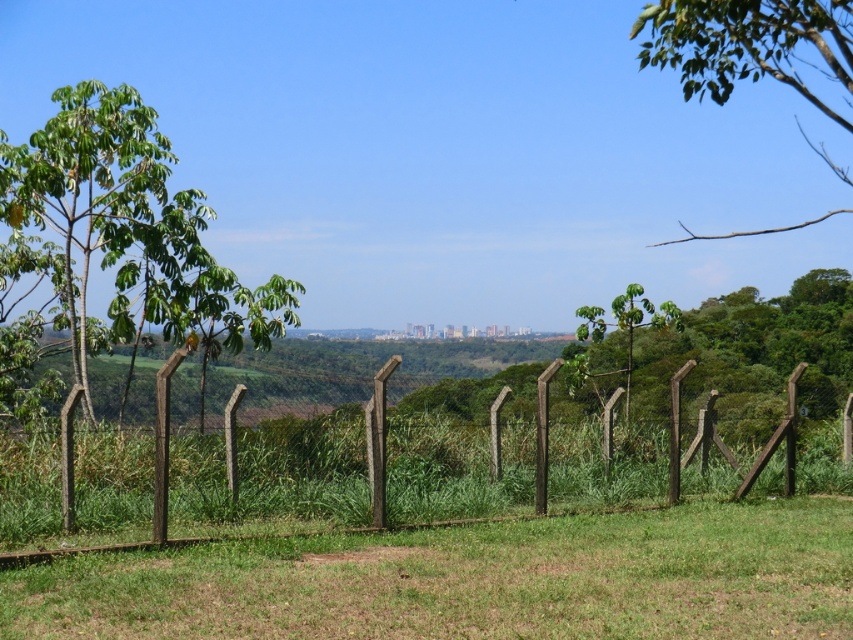
You are standing in the middle of the grassy area and want to walk towards the green leafy tree at left and the green leafy branch at upper right. Which object will you reach first?

You will reach the green leafy tree at left first because it is closer to you than the green leafy branch at upper right, which is further away.

You are standing in a park and want to take a photo of the brown wooden fence at center. If your camera can focus on objects up to 15 meters away, will you be able to capture the fence clearly?

The brown wooden fence at center is 12.53 meters away from the camera. Since 12.53 meters is within the camera focus range of up to 15 meters, the camera can focus on the brown wooden fence at center clearly.